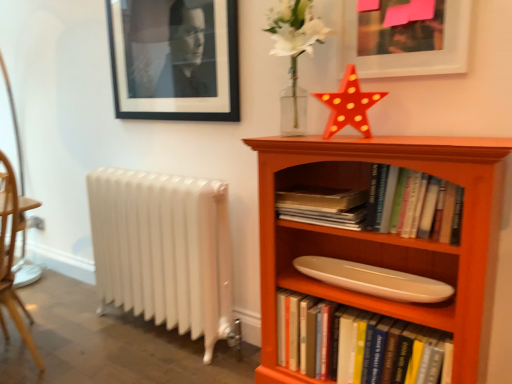
Question: Is matte white picture frame at upper right, positioned as the first picture frame in front-to-back order, not inside black matte picture frame at upper left, arranged as the 1th picture frame when viewed from the left?

Choices:
 (A) yes
 (B) no

Answer: (A)

Question: Considering the relative sizes of matte white picture frame at upper right, the second picture frame in the left-to-right sequence, and black matte picture frame at upper left, which ranks as the 1th picture frame in back-to-front order, in the image provided, is matte white picture frame at upper right, the second picture frame in the left-to-right sequence, smaller than black matte picture frame at upper left, which ranks as the 1th picture frame in back-to-front order,?

Choices:
 (A) yes
 (B) no

Answer: (A)

Question: Is matte white picture frame at upper right, which is the 2th picture frame in back-to-front order, aimed at black matte picture frame at upper left, arranged as the 1th picture frame when viewed from the left?

Choices:
 (A) yes
 (B) no

Answer: (B)

Question: From the image's perspective, does matte white picture frame at upper right, positioned as the first picture frame in front-to-back order, appear higher than black matte picture frame at upper left, which ranks as the 1th picture frame in back-to-front order?

Choices:
 (A) no
 (B) yes

Answer: (A)

Question: Does matte white picture frame at upper right, positioned as the first picture frame in front-to-back order, have a lesser width compared to black matte picture frame at upper left, arranged as the 1th picture frame when viewed from the left?

Choices:
 (A) yes
 (B) no

Answer: (A)

Question: Is matte white picture frame at upper right, acting as the 1th picture frame starting from the right, not near black matte picture frame at upper left, which ranks as the 2th picture frame in right-to-left order?

Choices:
 (A) no
 (B) yes

Answer: (A)

Question: Is shiny plastic star at upper center not close to white glossy surfboard at center?

Choices:
 (A) no
 (B) yes

Answer: (A)

Question: Can you confirm if shiny plastic star at upper center is wider than white glossy surfboard at center?

Choices:
 (A) yes
 (B) no

Answer: (B)

Question: Is shiny plastic star at upper center turned away from white glossy surfboard at center?

Choices:
 (A) no
 (B) yes

Answer: (A)

Question: Does shiny plastic star at upper center have a larger size compared to white glossy surfboard at center?

Choices:
 (A) no
 (B) yes

Answer: (A)

Question: Does shiny plastic star at upper center have a lesser width compared to white glossy surfboard at center?

Choices:
 (A) yes
 (B) no

Answer: (A)

Question: Can you confirm if shiny plastic star at upper center is shorter than white glossy surfboard at center?

Choices:
 (A) yes
 (B) no

Answer: (B)

Question: Is shiny plastic star at upper center shorter than black matte picture frame at upper left, which ranks as the 1th picture frame in back-to-front order?

Choices:
 (A) yes
 (B) no

Answer: (A)